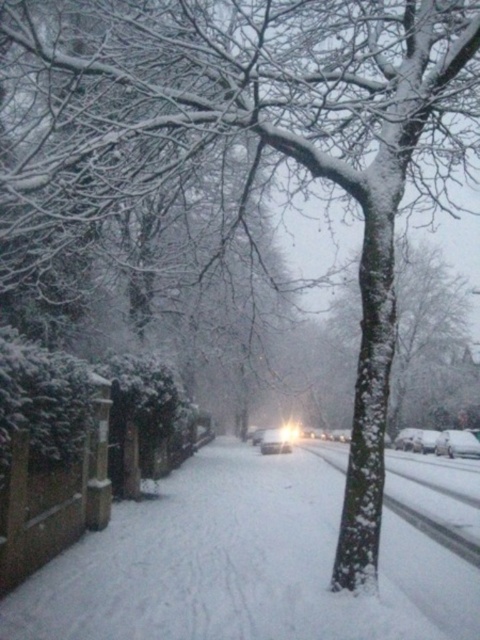
Question: Which point is closer to the camera?

Choices:
 (A) white matte car at center
 (B) white glossy headlight at center

Answer: (B)

Question: Which is farther from the white glossy headlight at center?

Choices:
 (A) white fluffy snow at center
 (B) white matte car at center
 (C) white glossy car at center

Answer: (A)

Question: Does white matte car at center have a larger size compared to white glossy headlight at center?

Choices:
 (A) no
 (B) yes

Answer: (A)

Question: Is the position of white glossy car at center less distant than that of white glossy headlight at center?

Choices:
 (A) no
 (B) yes

Answer: (B)

Question: Which of the following is the closest to the observer?

Choices:
 (A) (277, 438)
 (B) (283, 438)

Answer: (A)

Question: Can you confirm if white matte car at center is bigger than white glossy car at center?

Choices:
 (A) no
 (B) yes

Answer: (B)